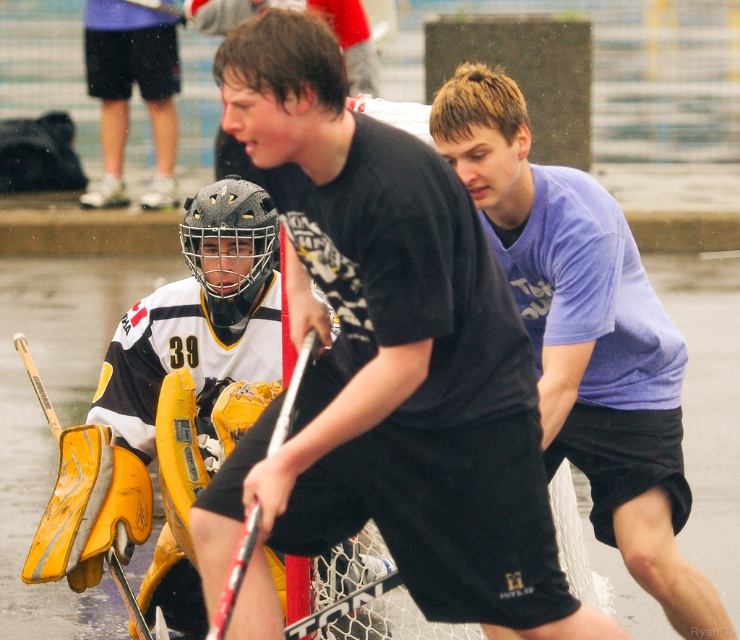
Question: Can you confirm if purple cotton shirt at center is smaller than black matte shorts at center?

Choices:
 (A) no
 (B) yes

Answer: (A)

Question: Which point is closer to the camera?

Choices:
 (A) (124, 128)
 (B) (222, 360)

Answer: (B)

Question: Estimate the real-world distances between objects in this image. Which object is farther from the yellow matte goalie pads at lower left?

Choices:
 (A) purple cotton shirt at center
 (B) black matte shirt at center

Answer: (B)

Question: Where is yellow matte goalie pads at lower left located in relation to black matte shorts at center in the image?

Choices:
 (A) left
 (B) right

Answer: (B)

Question: Which of these objects is positioned closest to the purple cotton shirt at center?

Choices:
 (A) yellow matte goalie pads at lower left
 (B) black matte shorts at center
 (C) black matte shirt at center

Answer: (C)

Question: Can you confirm if black matte shirt at center is positioned to the left of black matte shorts at center?

Choices:
 (A) yes
 (B) no

Answer: (B)